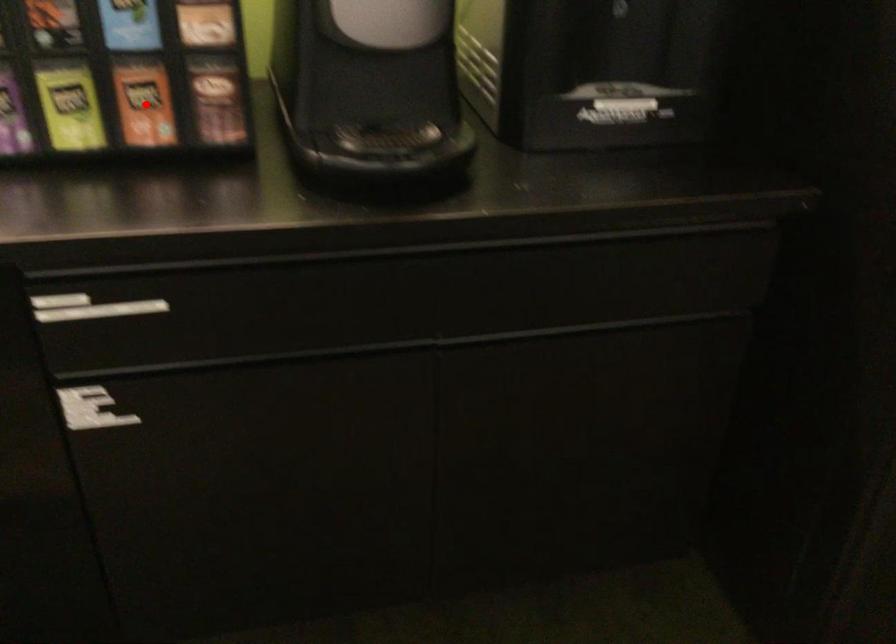
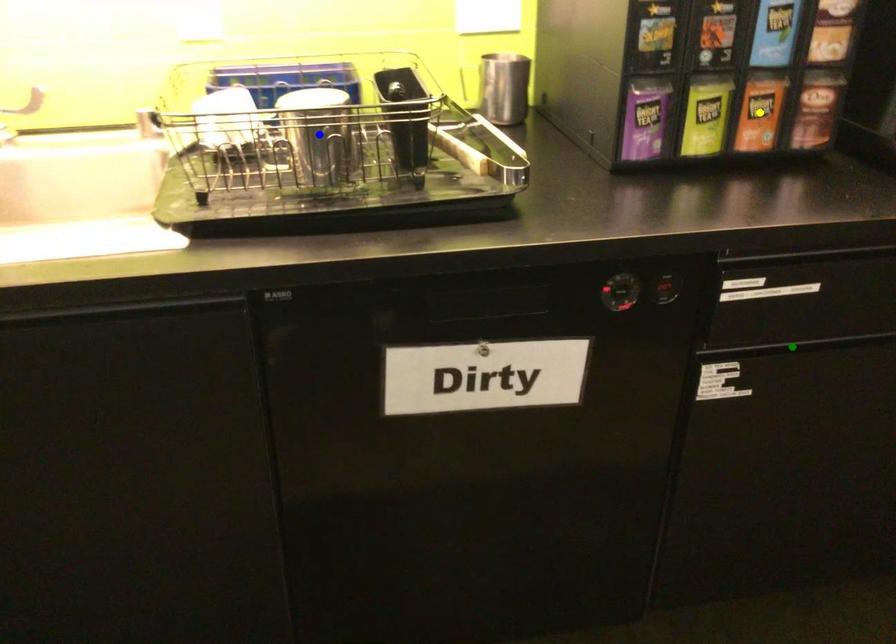
Question: I am providing you with two images of the same scene from different viewpoints. A red point is marked on the first image. You are given multiple points on the second image. Which spot in image 2 lines up with the point in image 1?

Choices:
 (A) green point
 (B) blue point
 (C) yellow point

Answer: (C)